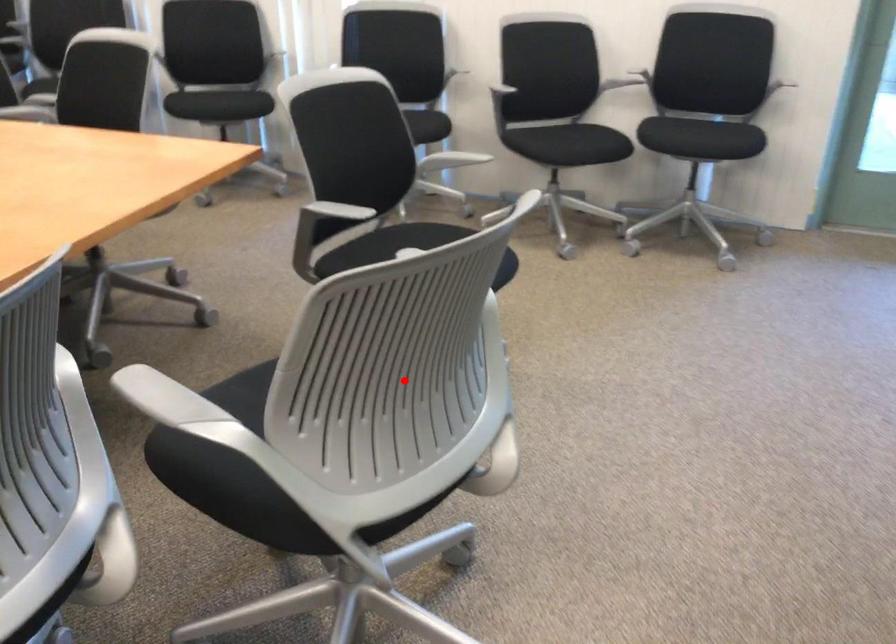
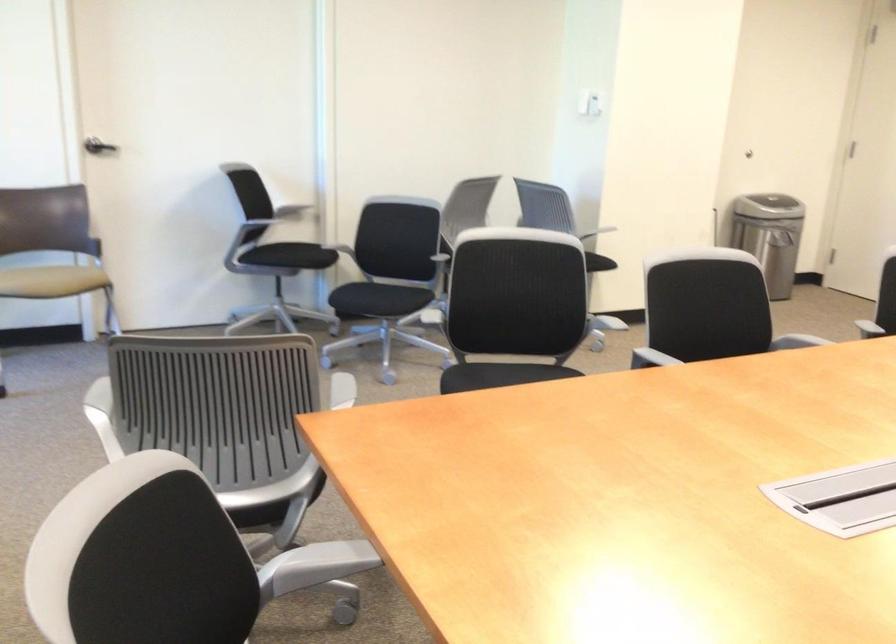
In the second image, find the point that corresponds to the highlighted location in the first image.

(513, 307)